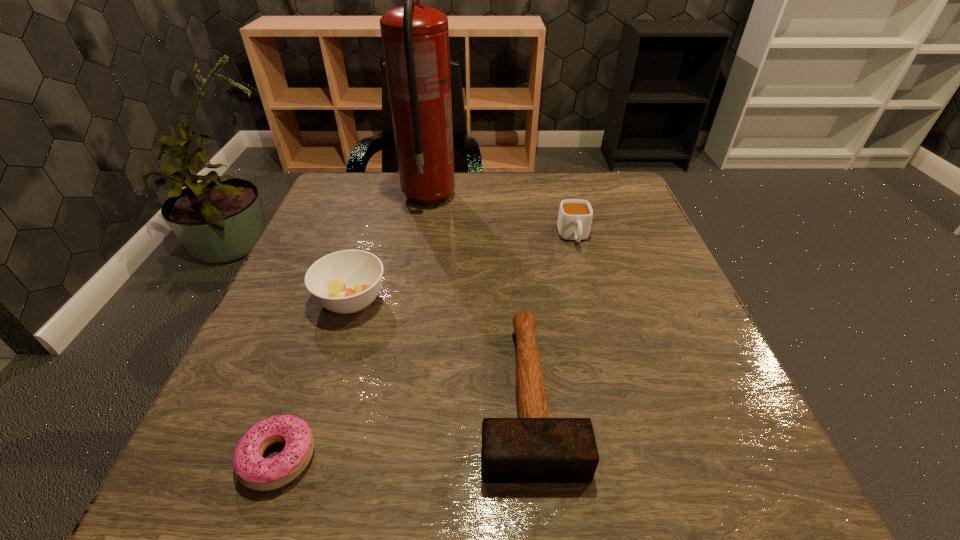
The width and height of the screenshot is (960, 540). In order to click on object located at the far edge in this screenshot , I will do [415, 38].

This screenshot has width=960, height=540. What are the coordinates of `mallet present at the near edge` in the screenshot? It's located at (533, 448).

Identify the location of doughnut that is at the near edge. point(255,472).

Where is `soup bowl that is at the left edge`? Image resolution: width=960 pixels, height=540 pixels. soup bowl that is at the left edge is located at coordinates (347, 281).

Where is `doughnut present at the left edge`? This screenshot has height=540, width=960. doughnut present at the left edge is located at coordinates (255, 472).

Where is `object that is at the right edge`? This screenshot has width=960, height=540. object that is at the right edge is located at coordinates (575, 216).

This screenshot has width=960, height=540. I want to click on object positioned at the near left corner, so click(255, 472).

Where is `blank area at the far edge`? The image size is (960, 540). blank area at the far edge is located at coordinates (383, 216).

The height and width of the screenshot is (540, 960). In the image, there is a desktop. What are the coordinates of `vacant space at the near edge` in the screenshot? It's located at (300, 497).

Where is `vacant region at the left edge`? The image size is (960, 540). vacant region at the left edge is located at coordinates (300, 258).